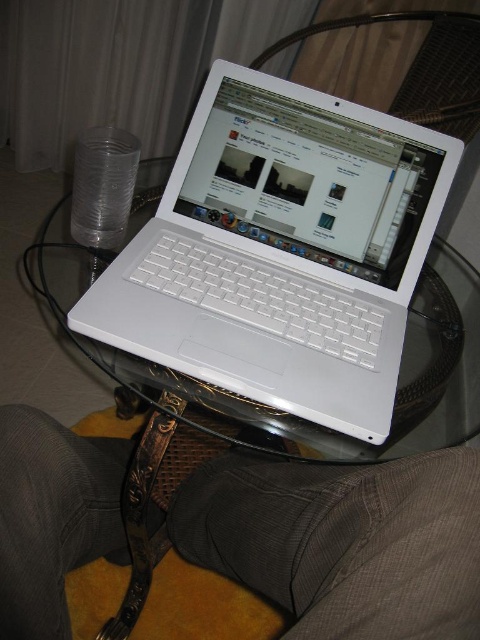
You are a person with a 50 cm long arm. You want to reach and pick up the white glossy laptop at center from your current position. Can you comfortably reach it?

The white glossy laptop at center is 47.97 centimeters away from the viewer. Since your arm is 50 cm long, you can comfortably reach it.

You are organizing items on a table and need to place a new item between the white glossy laptop at center and the gray fabric pants at lower center. Based on their current positions, where should you place the new item?

The white glossy laptop at center is positioned on the right side of gray fabric pants at lower center, so you should place the new item between them to the left of the white glossy laptop at center and to the right of the gray fabric pants at lower center.